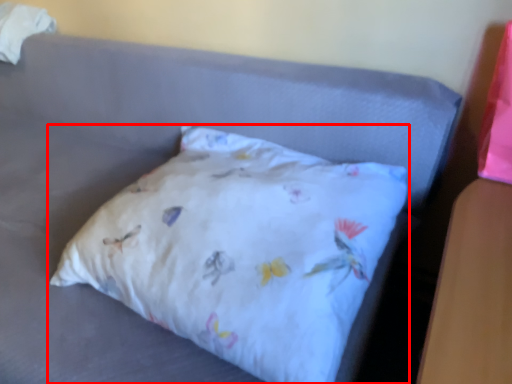
Question: Observing the image, what is the correct spatial positioning of pillow (annotated by the red box) in reference to material?

Choices:
 (A) left
 (B) right

Answer: (B)